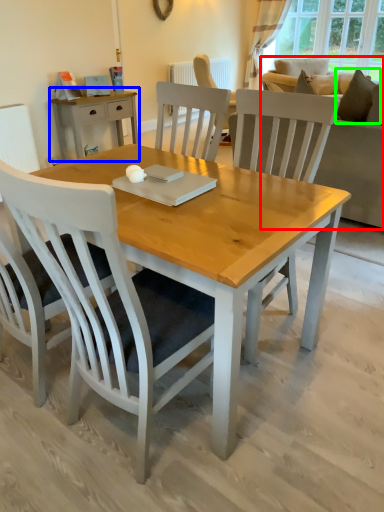
Question: Which object is positioned closest to studio couch (highlighted by a red box)? Select from desk (highlighted by a blue box) and pillow (highlighted by a green box).

Choices:
 (A) desk
 (B) pillow

Answer: (B)